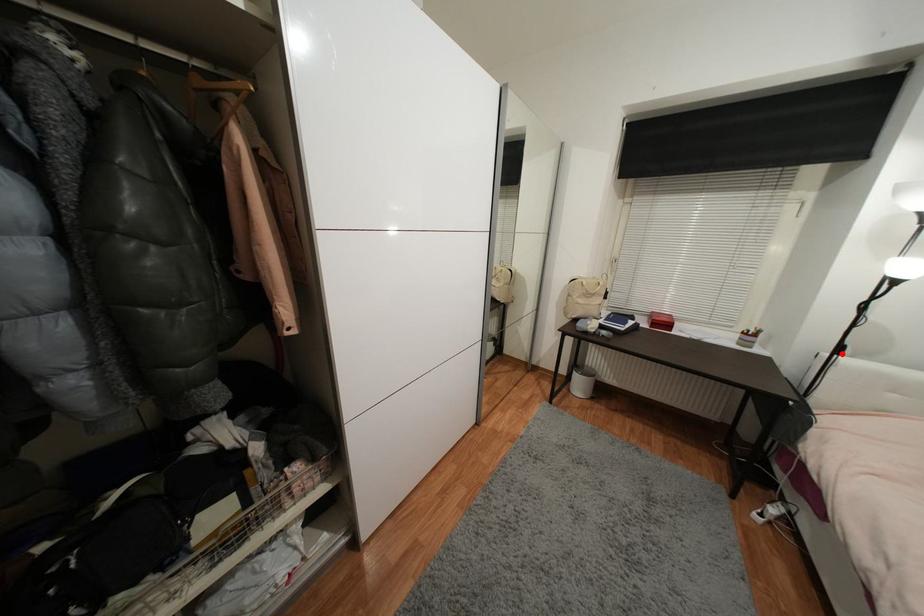
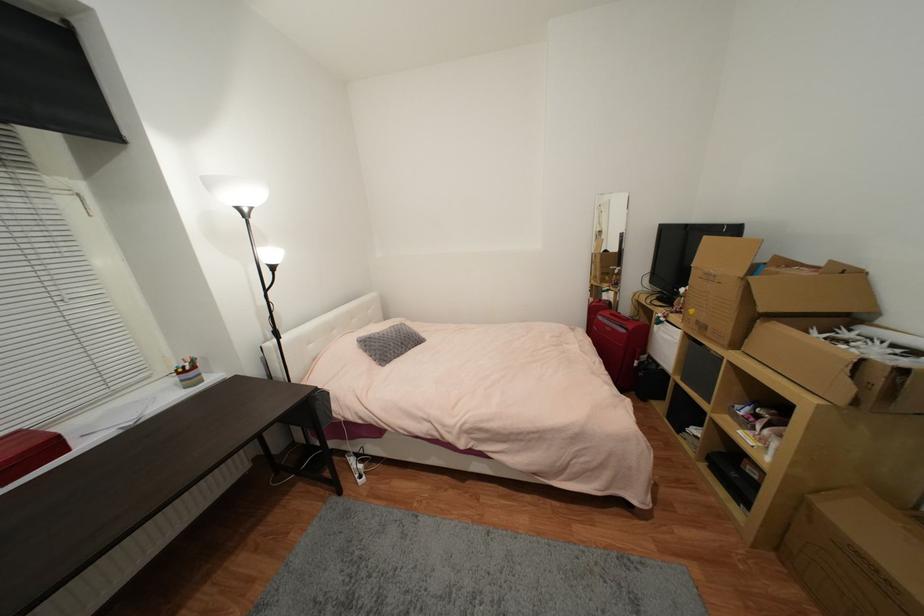
Question: I am providing you with two images of the same scene from different viewpoints. A red point is shown in image1. For the corresponding object point in image2, is it positioned nearer or farther from the camera?

Choices:
 (A) Nearer
 (B) Farther

Answer: (A)